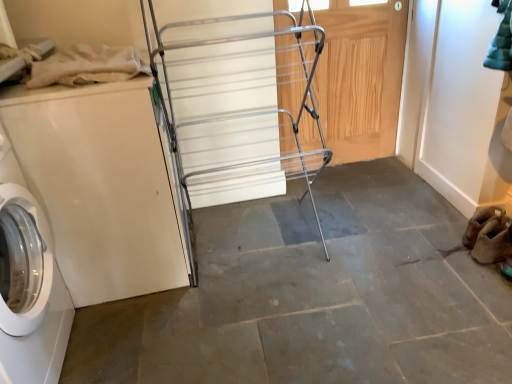
Where is `unoccupied area in front of silver metallic drying rack at center`? This screenshot has width=512, height=384. unoccupied area in front of silver metallic drying rack at center is located at coordinates (259, 323).